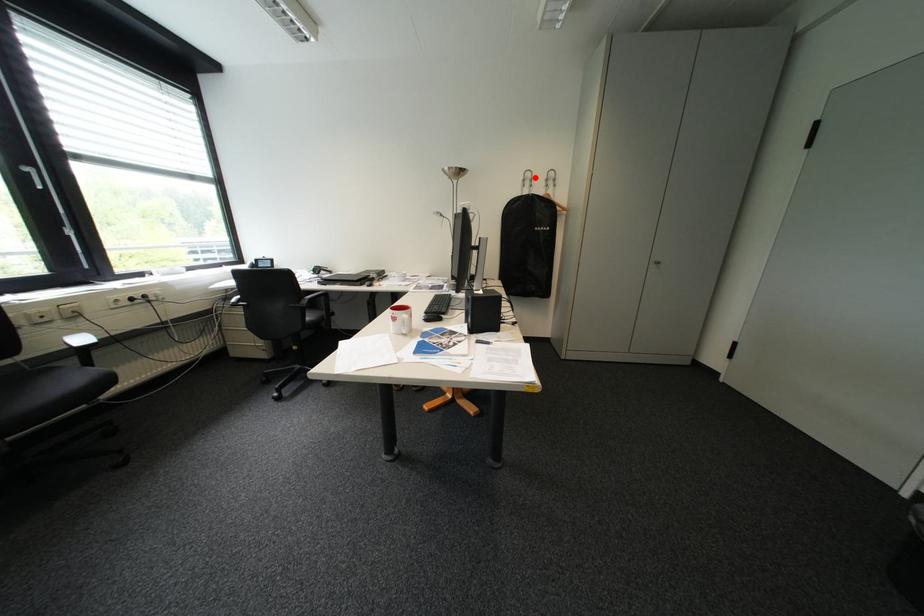
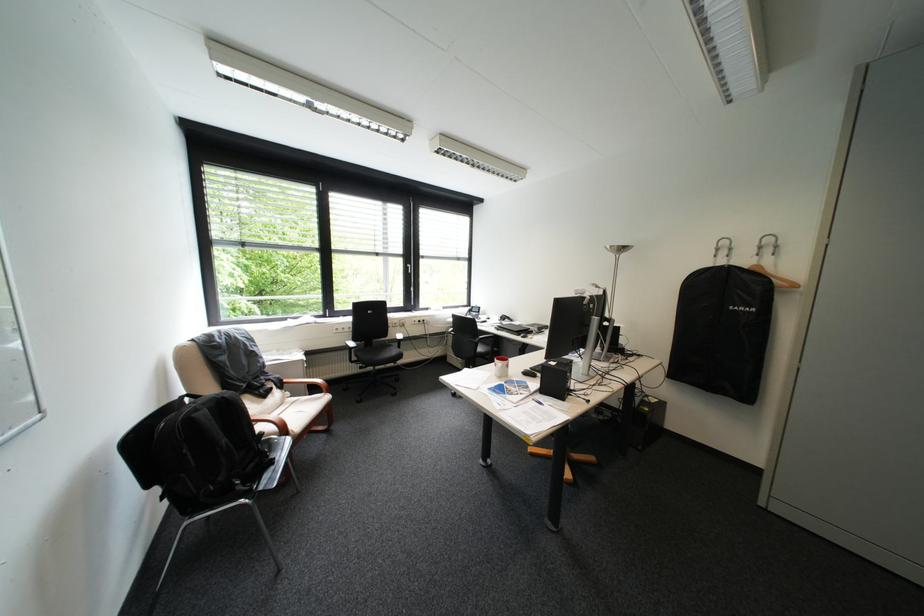
Question: I am providing you with two images of the same scene from different viewpoints. A red point is marked on the first image. Can you still see the location of the red point in image 2?

Choices:
 (A) Yes
 (B) No

Answer: (A)